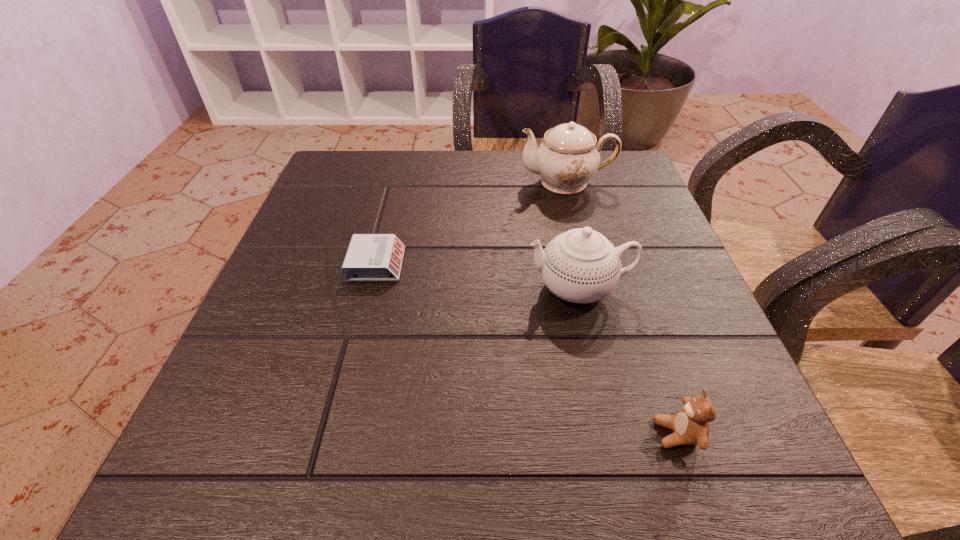
Find the location of a particular element. Image resolution: width=960 pixels, height=540 pixels. the farther chinaware is located at coordinates (568, 157).

Locate an element on the screen. the nearer chinaware is located at coordinates (581, 266).

In order to click on the third tallest object in this screenshot , I will do `click(690, 425)`.

The height and width of the screenshot is (540, 960). In order to click on the nearest object in this screenshot , I will do `click(690, 425)`.

Where is `the shortest object`? The width and height of the screenshot is (960, 540). the shortest object is located at coordinates (370, 257).

Find the location of a particular element. The height and width of the screenshot is (540, 960). the leftmost object is located at coordinates (370, 257).

What are the coordinates of `vacant area situated at the spout of the farther chinaware` in the screenshot? It's located at (486, 182).

Find the location of a particular element. Image resolution: width=960 pixels, height=540 pixels. free region located 0.060m at the spout of the farther chinaware is located at coordinates (493, 182).

Image resolution: width=960 pixels, height=540 pixels. I want to click on free space located at the spout of the farther chinaware, so click(490, 182).

Image resolution: width=960 pixels, height=540 pixels. In order to click on free spot located on the spout of the nearer chinaware in this screenshot , I will do `click(317, 287)`.